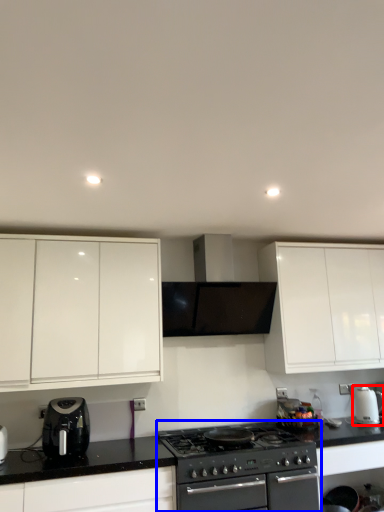
Question: Among these objects, which one is nearest to the camera, kitchen appliance (highlighted by a red box) or appliance (highlighted by a blue box)?

Choices:
 (A) kitchen appliance
 (B) appliance

Answer: (B)